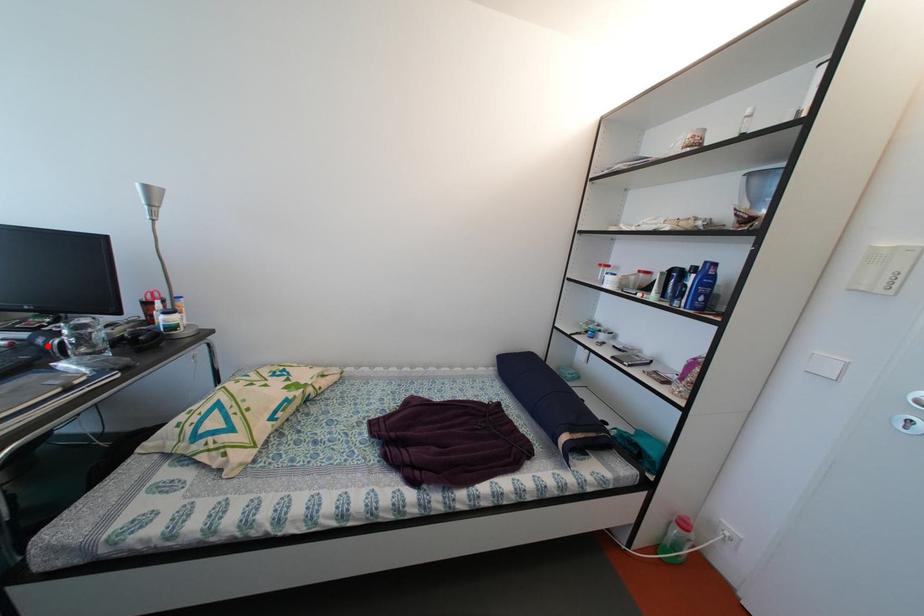
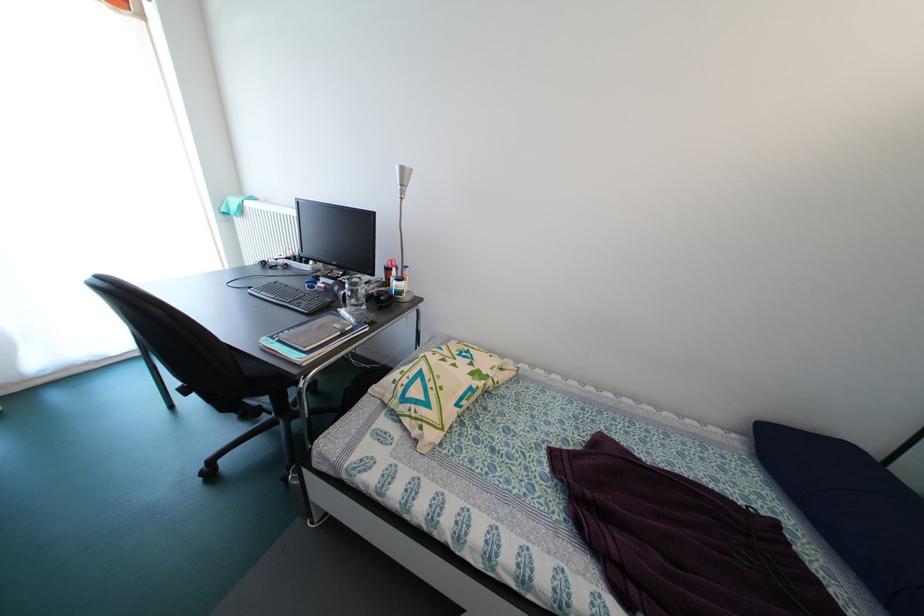
The point at the highlighted location is marked in the first image. Where is the corresponding point in the second image?

(344, 294)